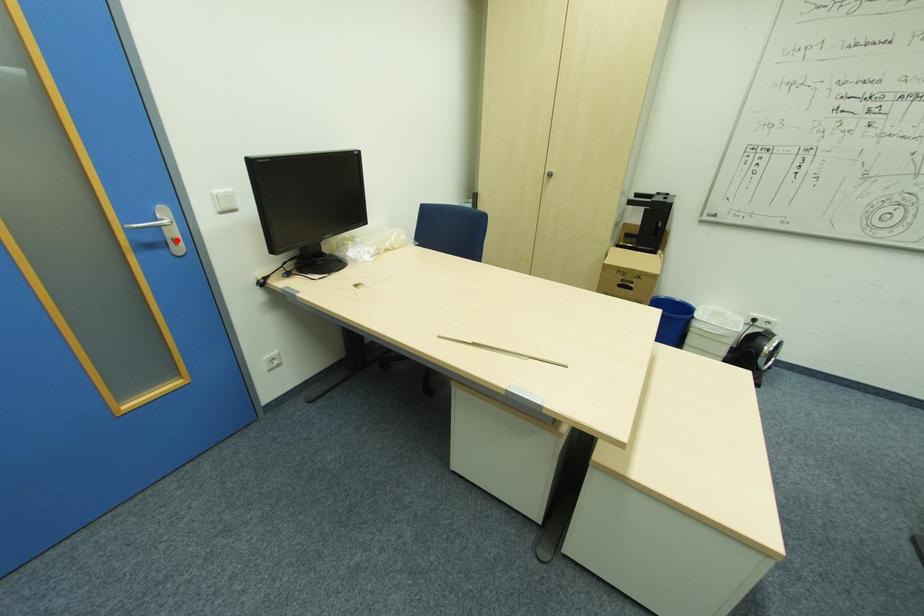
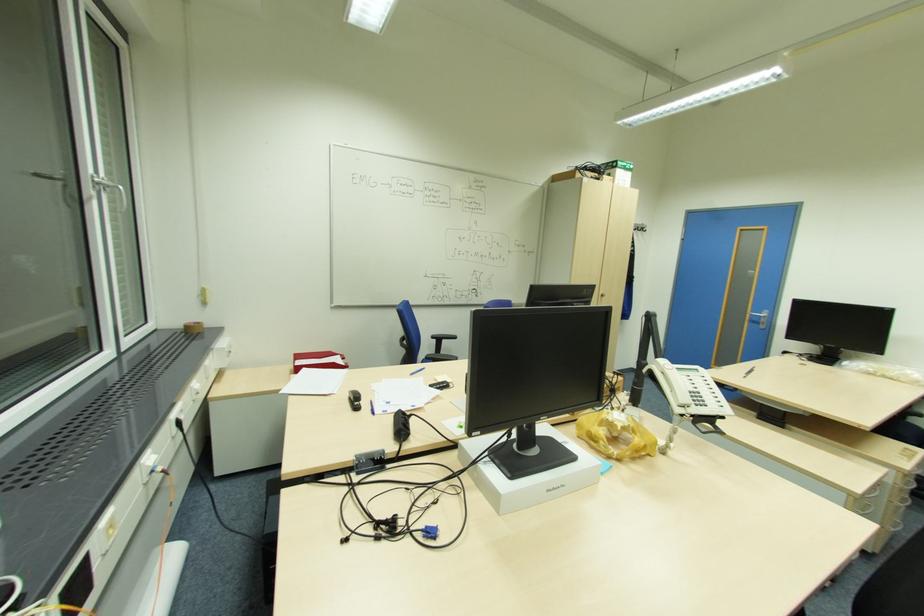
Locate, in the second image, the point that corresponds to the highlighted location in the first image.

(766, 323)